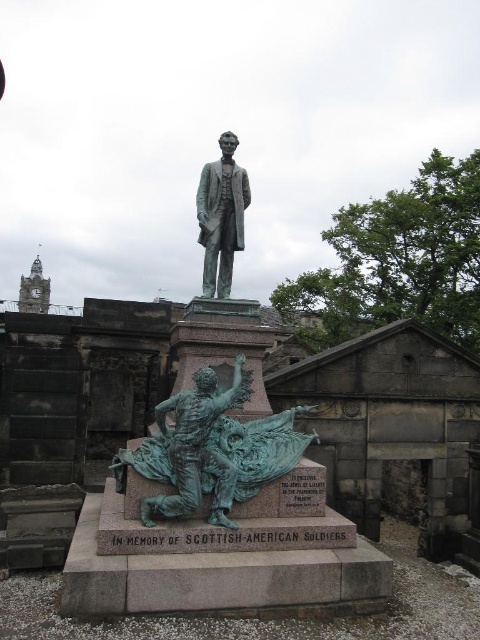
How distant is green patina figure at center from bronze statue at center?

green patina figure at center is 25.28 feet away from bronze statue at center.

Between green patina figure at center and bronze statue at center, which one has more height?

bronze statue at center

Is point (197, 404) closer to viewer compared to point (240, 177)?

Yes, point (197, 404) is closer to viewer.

The image size is (480, 640). Identify the location of green patina figure at center. (195, 449).